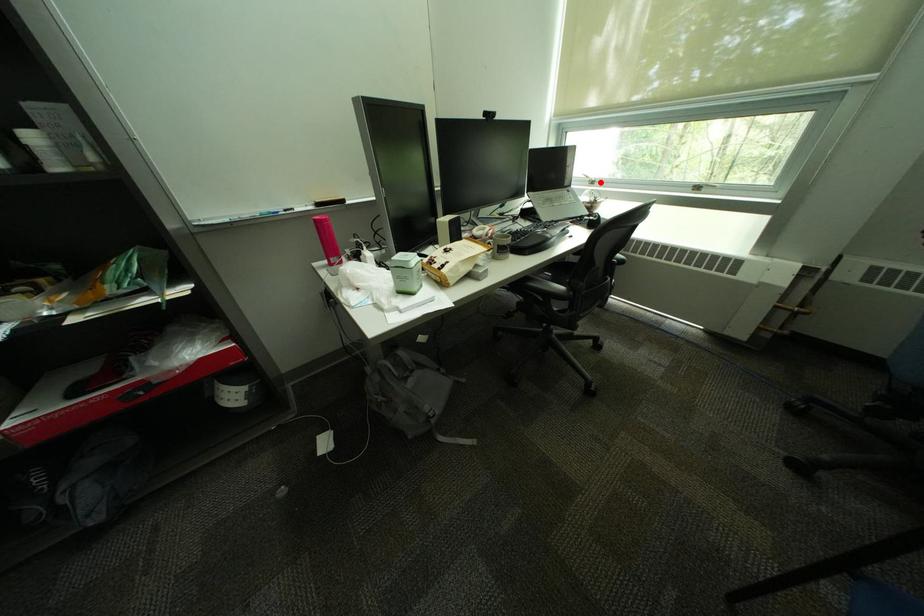
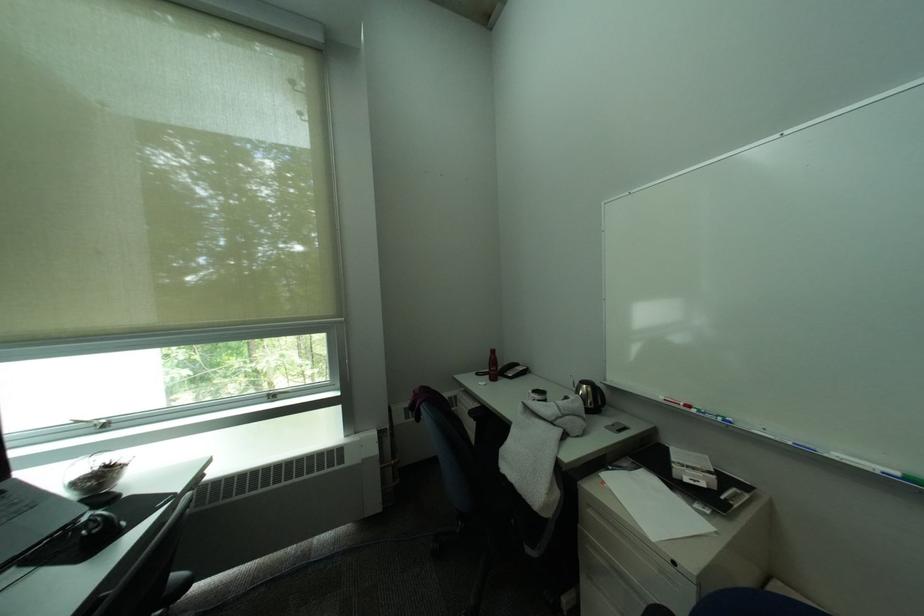
Find the pixel in the second image that matches the highlighted location in the first image.

(106, 427)